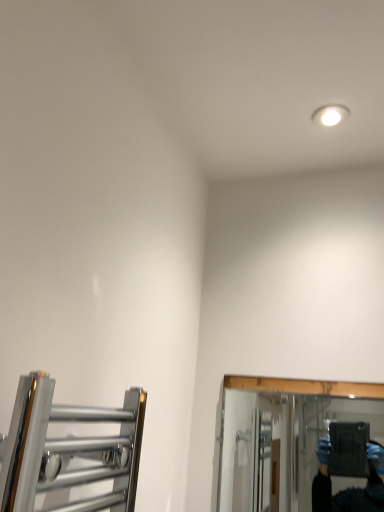
The width and height of the screenshot is (384, 512). Describe the element at coordinates (330, 115) in the screenshot. I see `white glossy light fixture at upper right` at that location.

Where is `white glossy light fixture at upper right`? white glossy light fixture at upper right is located at coordinates (330, 115).

In order to click on white glossy light fixture at upper right in this screenshot , I will do `click(330, 115)`.